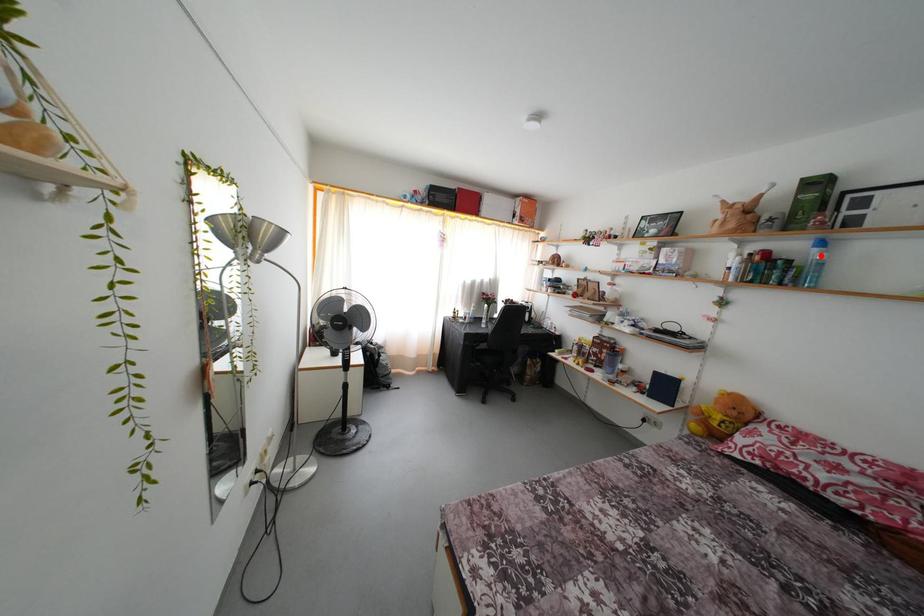
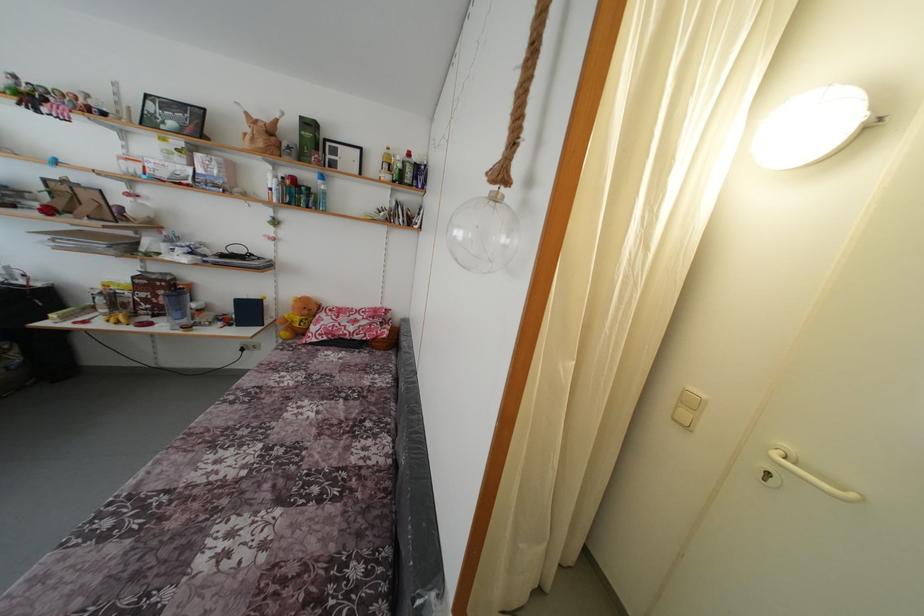
Question: I am providing you with two images of the same scene from different viewpoints. A red point is marked on the first image. Is the red point's position out of view in image 2?

Choices:
 (A) Yes
 (B) No

Answer: (B)